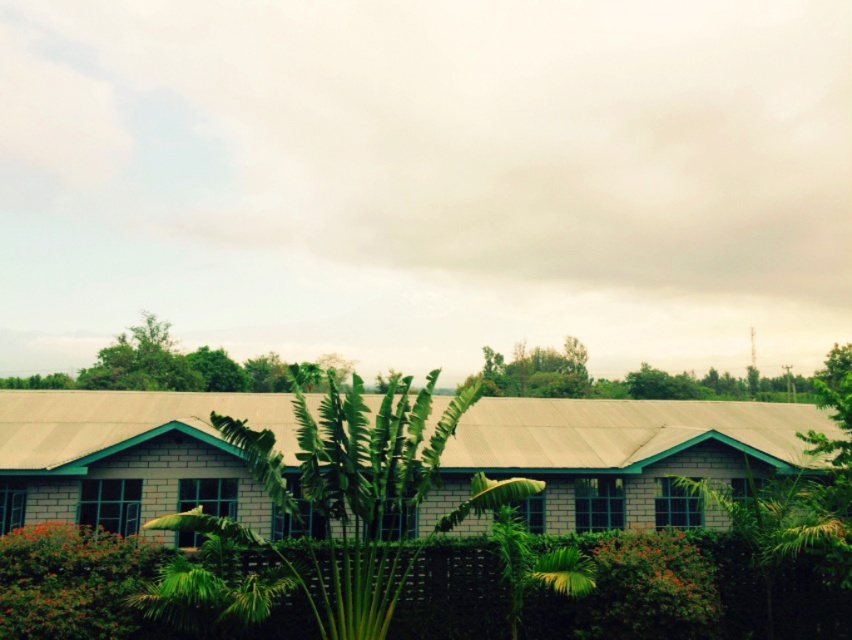
Question: Among these objects, which one is nearest to the camera?

Choices:
 (A) white brick building at center
 (B) green leafy tree at center

Answer: (B)

Question: Where is white brick building at center located in relation to green leafy tree at center in the image?

Choices:
 (A) right
 (B) left

Answer: (A)

Question: From the image, what is the correct spatial relationship of white brick building at center in relation to green leafy tree at center?

Choices:
 (A) left
 (B) right

Answer: (B)

Question: Among these points, which one is farthest from the camera?

Choices:
 (A) (409, 413)
 (B) (462, 444)

Answer: (B)

Question: Is white brick building at center positioned behind green leafy tree at center?

Choices:
 (A) yes
 (B) no

Answer: (A)